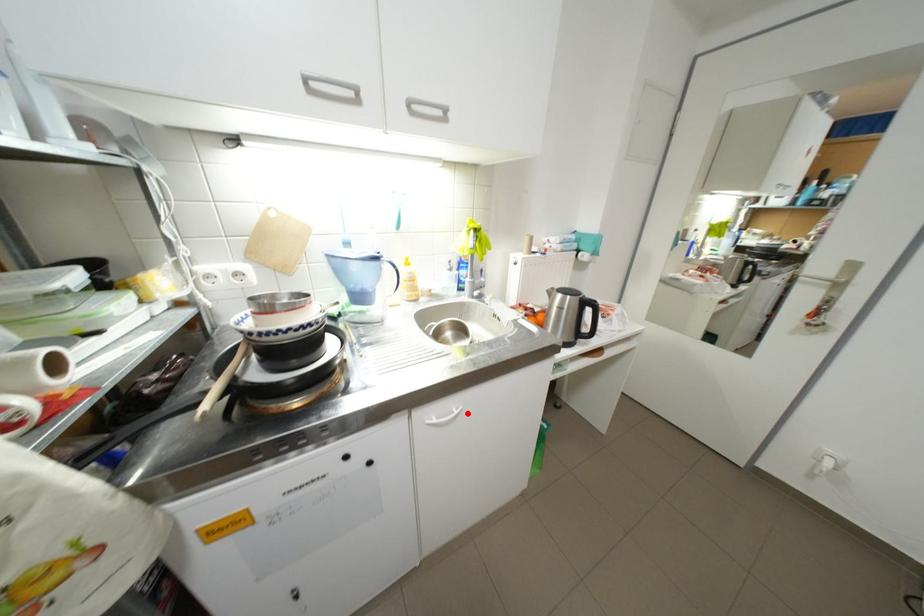
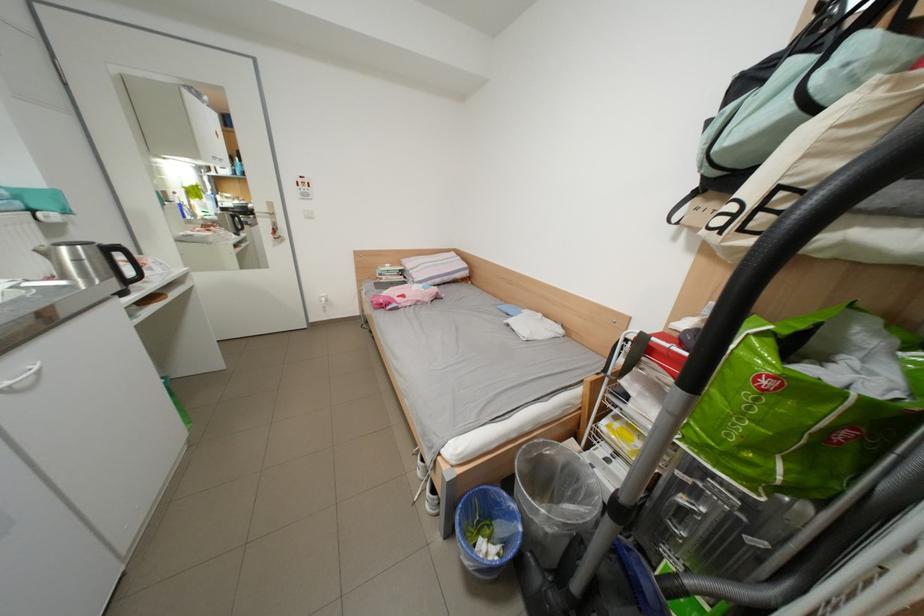
Question: A red point is marked in image1. In image2, is the corresponding 3D point closer to the camera or farther? Reply with the corresponding letter.

Choices:
 (A) The corresponding 3D point is closer.
 (B) The corresponding 3D point is farther.

Answer: (B)